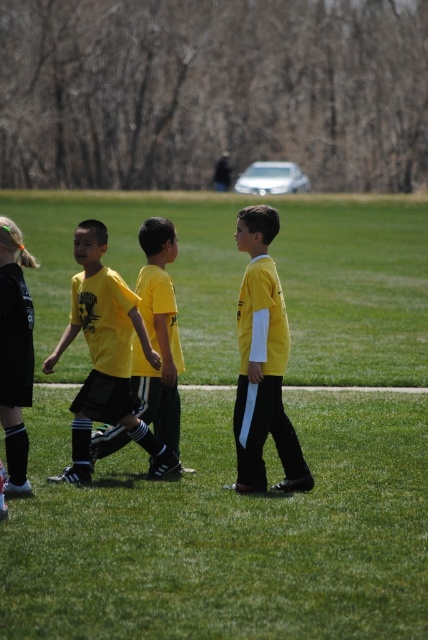
Does matte yellow shirt at center have a lesser width compared to black matte shorts at lower left?

Incorrect, matte yellow shirt at center's width is not less than black matte shorts at lower left's.

Is matte yellow shirt at center positioned before black matte shorts at lower left?

No, it is not.

The image size is (428, 640). Describe the element at coordinates (106, 356) in the screenshot. I see `matte yellow shirt at center` at that location.

Identify the location of matte yellow shirt at center. (106, 356).

Measure the distance between yellow matte shirt at center and black matte shorts at lower left.

A distance of 1.65 meters exists between yellow matte shirt at center and black matte shorts at lower left.

Is point (256, 259) closer to viewer compared to point (24, 369)?

No, it is behind (24, 369).

Find the location of a particular element. yellow matte shirt at center is located at coordinates (262, 362).

Can you confirm if green grass at center is taller than yellow matte shirt at center?

Indeed, green grass at center has a greater height compared to yellow matte shirt at center.

What do you see at coordinates (207, 474) in the screenshot?
I see `green grass at center` at bounding box center [207, 474].

This screenshot has height=640, width=428. Find the location of `green grass at center`. green grass at center is located at coordinates (207, 474).